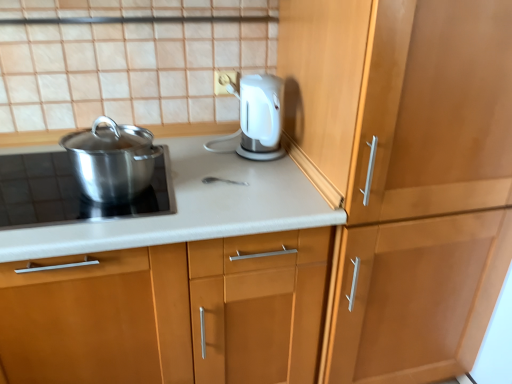
Question: In the image, is matte white countertop at center, arranged as the 1th cabinetry when viewed from the left, positioned in front of or behind polished stainless steel pot at left?

Choices:
 (A) front
 (B) behind

Answer: (A)

Question: Do you think matte white countertop at center, the second cabinetry when ordered from right to left, is within polished stainless steel pot at left, or outside of it?

Choices:
 (A) outside
 (B) inside

Answer: (A)

Question: Which is nearer to the wooden cabinet at right, the 1th cabinetry viewed from the right?

Choices:
 (A) polished stainless steel pot at left
 (B) matte white countertop at center, the second cabinetry when ordered from right to left
 (C) polished stainless steel pot at left

Answer: (B)

Question: Based on their relative distances, which object is nearer to the polished stainless steel pot at left?

Choices:
 (A) wooden cabinet at right, the 1th cabinetry viewed from the right
 (B) matte white countertop at center, arranged as the 1th cabinetry when viewed from the left
 (C) polished stainless steel pot at left

Answer: (C)